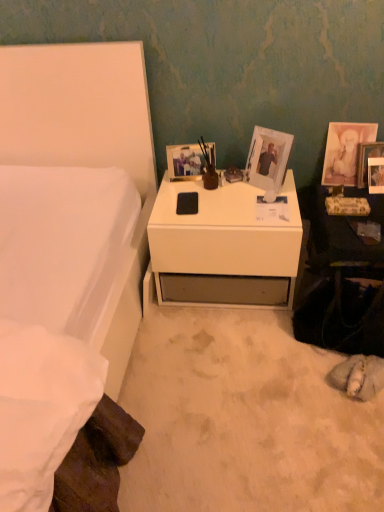
Question: In terms of width, does matte white picture frame at upper right, acting as the 1th picture frame starting from the right, look wider or thinner when compared to white matte desk at center?

Choices:
 (A) thin
 (B) wide

Answer: (A)

Question: Relative to white matte desk at center, is matte white picture frame at upper right, acting as the 1th picture frame starting from the right, in front or behind?

Choices:
 (A) front
 (B) behind

Answer: (B)

Question: Which is nearer to the green floral magazine at right?

Choices:
 (A) white plastic picture frame at upper center, acting as the 3th picture frame starting from the right
 (B) matte white picture frame at upper right, acting as the 1th picture frame starting from the right
 (C) white matte desk at center
 (D) white matte bed at left
 (E) matte white picture frame at upper right, acting as the second picture frame starting from the right

Answer: (B)

Question: Based on their relative distances, which object is farther from the green floral magazine at right?

Choices:
 (A) matte plastic picture frame at center, the first picture frame positioned from the left
 (B) white matte desk at center
 (C) matte white picture frame at upper right, the 3th picture frame from the left
 (D) white plastic picture frame at upper center, the second picture frame in the left-to-right sequence
 (E) white matte bed at left

Answer: (E)